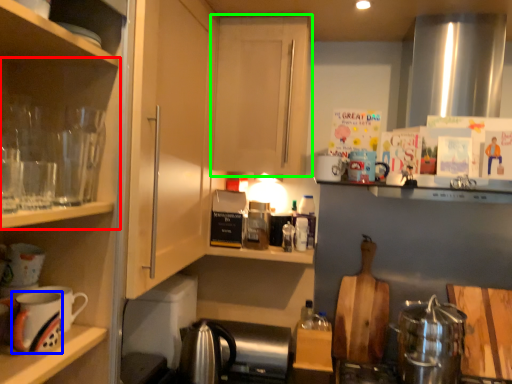
Question: Which is farther away from shelf (highlighted by a red box)? mug (highlighted by a blue box) or cabinetry (highlighted by a green box)?

Choices:
 (A) mug
 (B) cabinetry

Answer: (B)